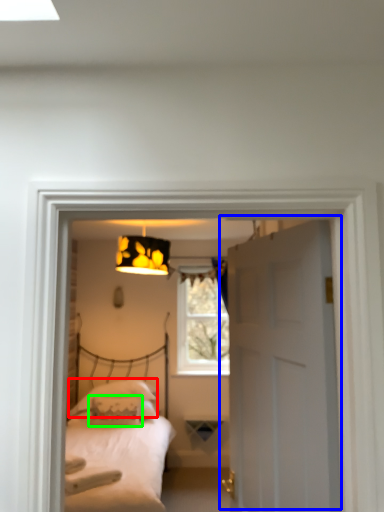
Question: Considering the real-world distances, which object is farthest from pillow (highlighted by a red box)? door (highlighted by a blue box) or pillow (highlighted by a green box)?

Choices:
 (A) door
 (B) pillow

Answer: (A)